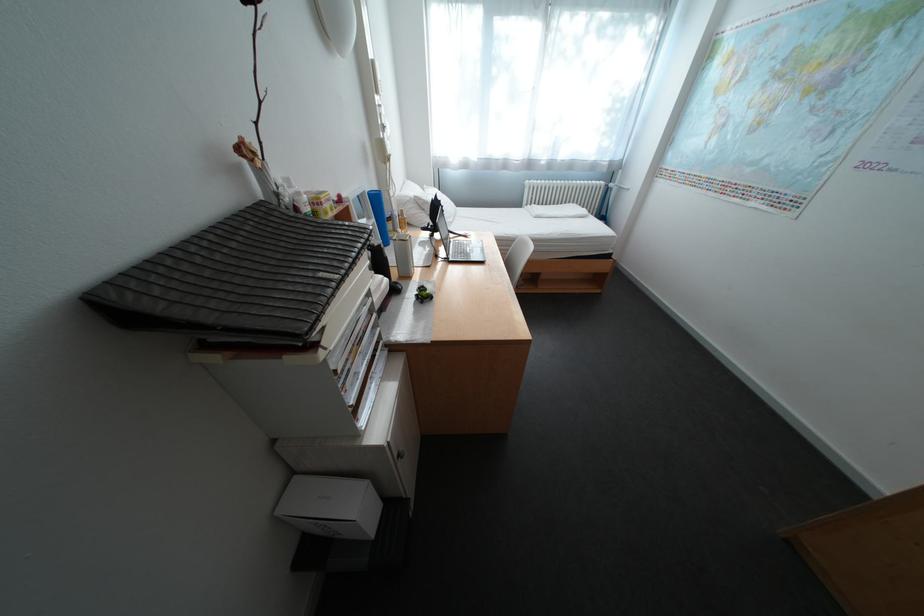
Locate an element on the screen. This screenshot has width=924, height=616. laptop lid is located at coordinates (467, 249).